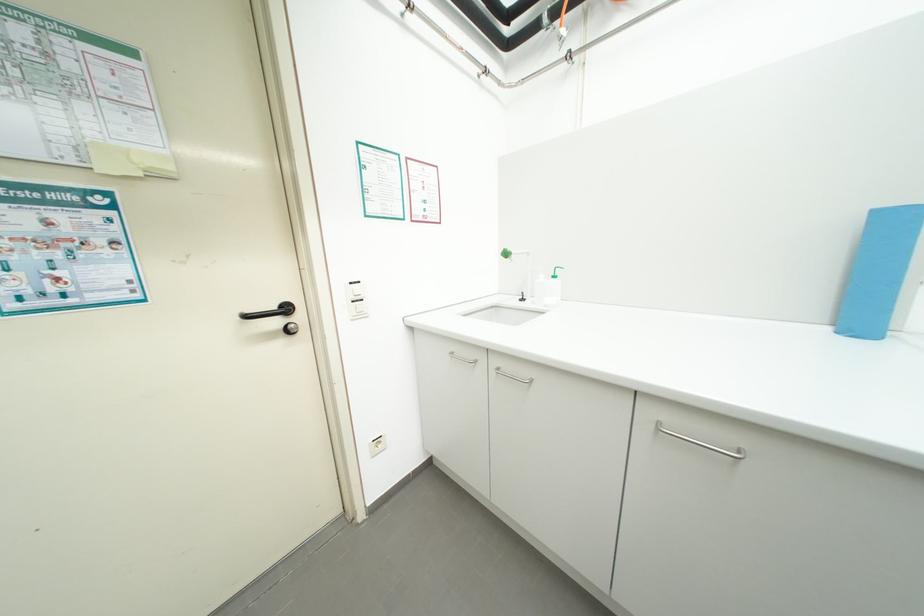
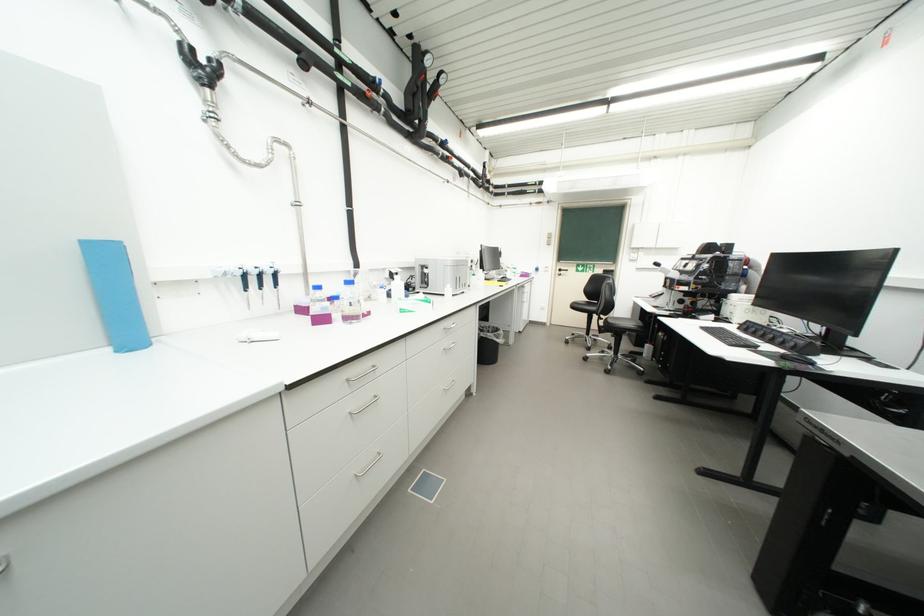
Question: The first image is from the beginning of the video and the second image is from the end. How did the camera likely rotate when shooting the video?

Choices:
 (A) Left
 (B) Right
 (C) Up
 (D) Down

Answer: (B)